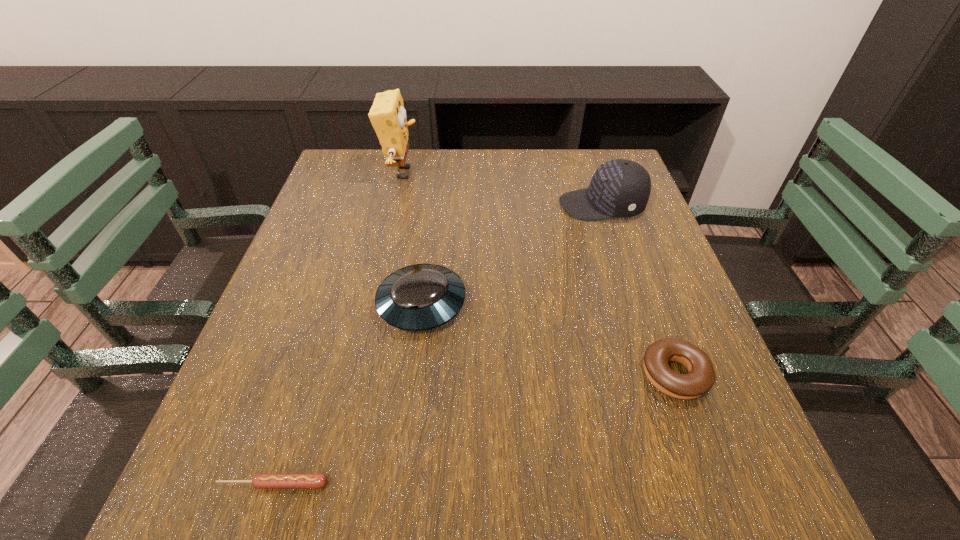
At what (x,y) coordinates should I click in order to perform the action: click on free space at the near right corner of the desktop. Please return your answer as a coordinate pair (x, y). Looking at the image, I should click on (759, 465).

The image size is (960, 540). Find the location of `free point between the second tallest object and the shortest object`. free point between the second tallest object and the shortest object is located at coordinates (438, 345).

I want to click on free space between the second shortest object and the sausage, so click(x=474, y=429).

The width and height of the screenshot is (960, 540). What are the coordinates of `free space between the nearest object and the third shortest object` in the screenshot? It's located at (348, 394).

Identify the location of free space between the baseball cap and the sponge. (502, 189).

Where is `empty space between the baseball cap and the shortest object`? The image size is (960, 540). empty space between the baseball cap and the shortest object is located at coordinates (438, 345).

Identify the location of empty space between the sausage and the tallest object. (338, 328).

Identify the location of vacant area that lies between the third nearest object and the second nearest object. The height and width of the screenshot is (540, 960). (548, 339).

What are the coordinates of `free area in between the tallest object and the shortest object` in the screenshot? It's located at (338, 328).

At what (x,y) coordinates should I click in order to perform the action: click on vacant space that's between the fourth shortest object and the third tallest object. Please return your answer as a coordinate pair (x, y). Image resolution: width=960 pixels, height=540 pixels. Looking at the image, I should click on (512, 254).